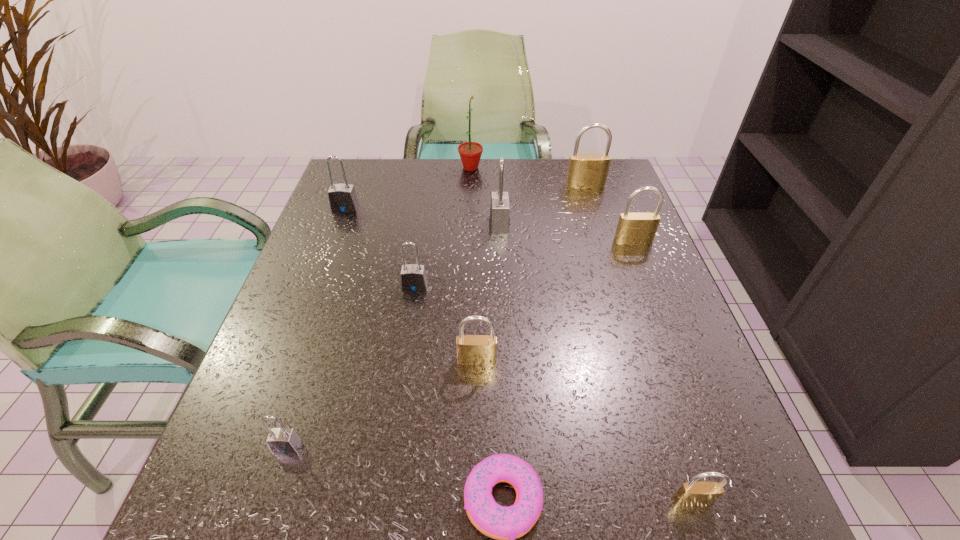
Find the location of a particular element. brass padlock that is the closest to the second farthest object is located at coordinates (633, 228).

Select which gray padlock is the closest to the nearest brass padlock. Please provide its 2D coordinates. Your answer should be formatted as a tuple, i.e. [(x, y)], where the tuple contains the x and y coordinates of a point satisfying the conditions above.

[(281, 440)]

Select which gray padlock is the third closest to the nearest brass padlock. Please provide its 2D coordinates. Your answer should be formatted as a tuple, i.e. [(x, y)], where the tuple contains the x and y coordinates of a point satisfying the conditions above.

[(499, 219)]

Where is `free space that satisfies the following two spatial constraints: 1. on the shackle of the sixth nearest padlock; 2. on the front-facing side of the third biggest brass padlock`? Image resolution: width=960 pixels, height=540 pixels. free space that satisfies the following two spatial constraints: 1. on the shackle of the sixth nearest padlock; 2. on the front-facing side of the third biggest brass padlock is located at coordinates (507, 360).